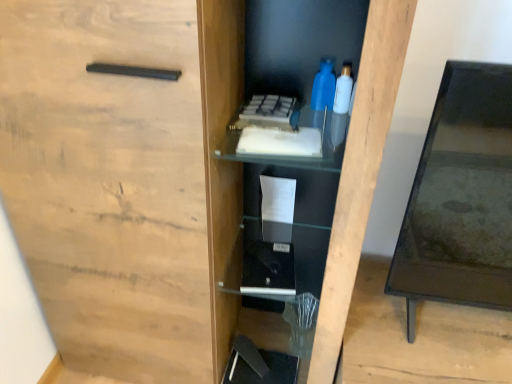
Question: Does point (329, 79) appear closer or farther from the camera than point (337, 94)?

Choices:
 (A) farther
 (B) closer

Answer: (B)

Question: Would you say blue plastic bottle at upper center, arranged as the first bottle when viewed from the left, is to the left or to the right of translucent plastic bottle at upper right, placed as the second bottle when sorted from left to right, in the picture?

Choices:
 (A) right
 (B) left

Answer: (B)

Question: Which of these objects is positioned closest to the translucent plastic bottle at upper right, placed as the second bottle when sorted from left to right?

Choices:
 (A) black glass table at right
 (B) blue plastic bottle at upper center, arranged as the first bottle when viewed from the left

Answer: (B)

Question: Considering the real-world distances, which object is closest to the blue plastic bottle at upper center, which appears as the 2th bottle when viewed from the right?

Choices:
 (A) translucent plastic bottle at upper right, the 1th bottle viewed from the right
 (B) black glass table at right

Answer: (A)